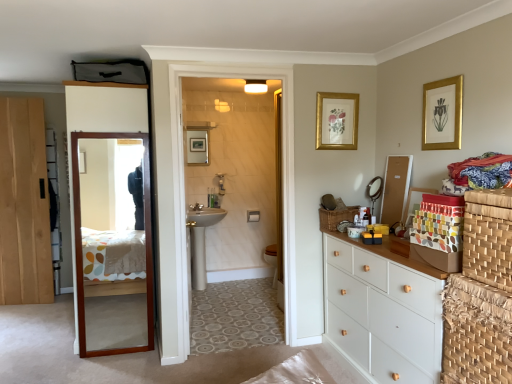
Identify the location of free space above natural wood door at left, which ranks as the second door in right-to-left order (from a real-world perspective). The image size is (512, 384). (14, 100).